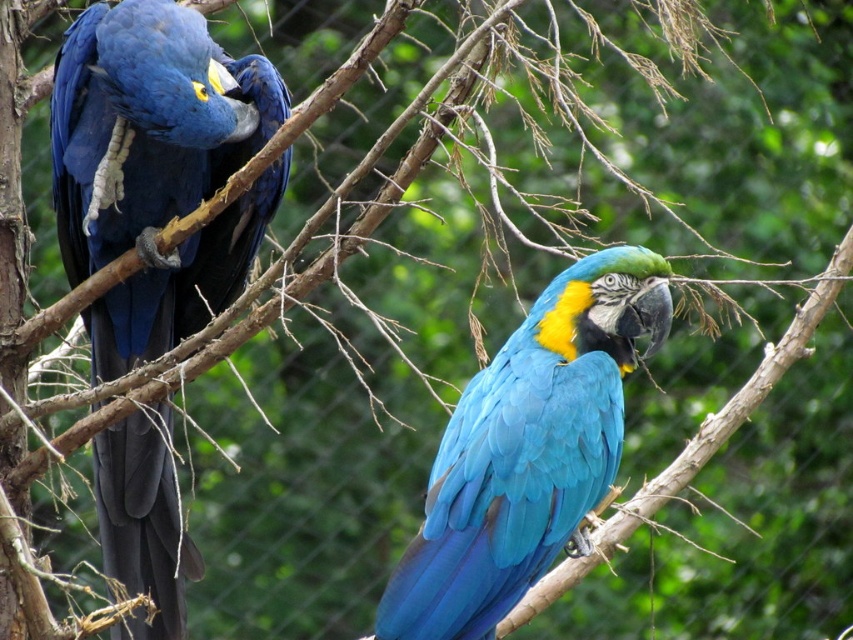
Question: Which object is closer to the camera taking this photo?

Choices:
 (A) blue glossy parrot at center
 (B) matte blue parrot at left

Answer: (A)

Question: Is matte blue parrot at left further to camera compared to blue glossy parrot at center?

Choices:
 (A) no
 (B) yes

Answer: (B)

Question: Is matte blue parrot at left further to the viewer compared to blue glossy parrot at center?

Choices:
 (A) no
 (B) yes

Answer: (B)

Question: Is matte blue parrot at left wider than blue glossy parrot at center?

Choices:
 (A) no
 (B) yes

Answer: (B)